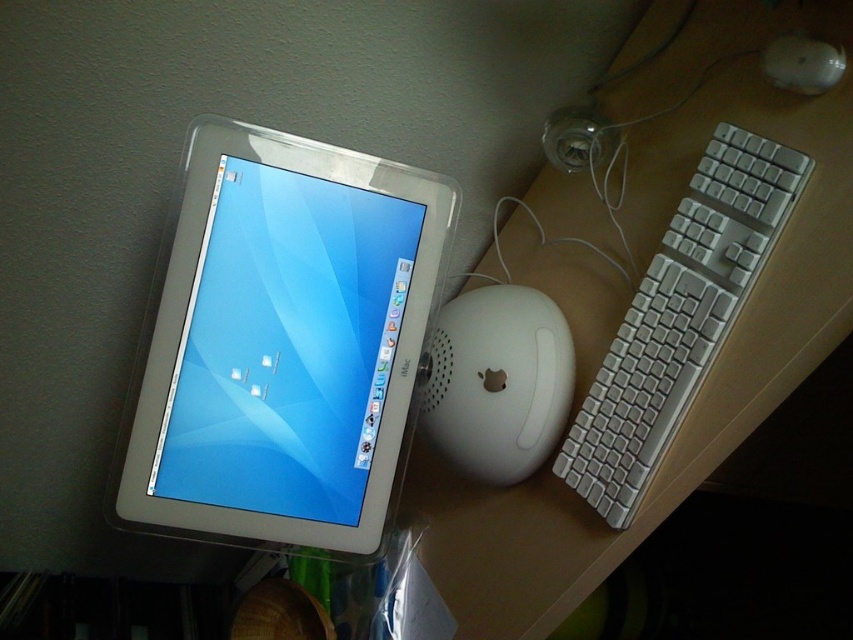
Can you confirm if white plastic keyboard at right is wider than white matte mouse at center?

Yes.

What do you see at coordinates (679, 317) in the screenshot? I see `white plastic keyboard at right` at bounding box center [679, 317].

At what (x,y) coordinates should I click in order to perform the action: click on white plastic keyboard at right. Please return your answer as a coordinate pair (x, y). Looking at the image, I should click on (679, 317).

Does white glossy computer monitor at upper left have a larger size compared to white matte mouse at center?

Correct, white glossy computer monitor at upper left is larger in size than white matte mouse at center.

Does white glossy computer monitor at upper left appear on the left side of white matte mouse at center?

Correct, you'll find white glossy computer monitor at upper left to the left of white matte mouse at center.

Image resolution: width=853 pixels, height=640 pixels. In order to click on white glossy computer monitor at upper left in this screenshot , I will do click(x=281, y=342).

Can you confirm if white glossy computer monitor at upper left is thinner than white plastic keyboard at right?

No, white glossy computer monitor at upper left is not thinner than white plastic keyboard at right.

I want to click on white glossy computer monitor at upper left, so coord(281,342).